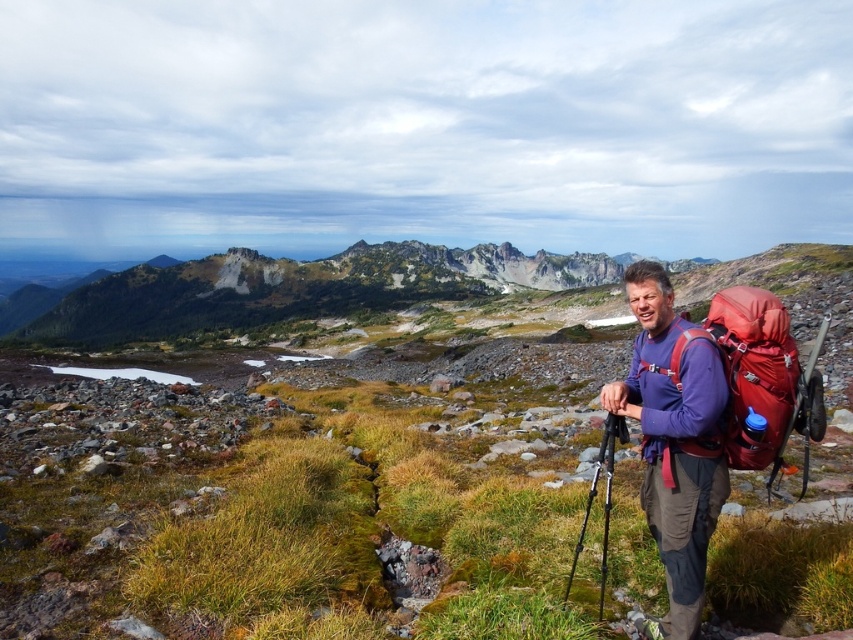
Question: Which object is the closest to the matte red backpack at right?

Choices:
 (A) green grass at center
 (B) black metal tripod at center

Answer: (B)

Question: Which of the following is the farthest from the observer?

Choices:
 (A) (175, 582)
 (B) (776, 362)

Answer: (A)

Question: Which point is farther to the camera?

Choices:
 (A) (763, 420)
 (B) (158, 481)
 (C) (611, 440)

Answer: (B)

Question: Observing the image, what is the correct spatial positioning of green grass at center in reference to black metal tripod at center?

Choices:
 (A) above
 (B) below

Answer: (A)

Question: Is matte red backpack at right wider than black metal tripod at center?

Choices:
 (A) yes
 (B) no

Answer: (A)

Question: Is matte red backpack at right bigger than black metal tripod at center?

Choices:
 (A) no
 (B) yes

Answer: (A)